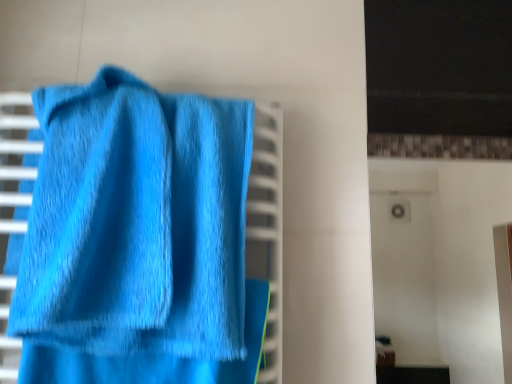
This screenshot has width=512, height=384. I want to click on blue fuzzy towel at left, so click(136, 222).

What do you see at coordinates (136, 222) in the screenshot?
I see `blue fuzzy towel at left` at bounding box center [136, 222].

At what (x,y) coordinates should I click in order to perform the action: click on blue fuzzy towel at left. Please return your answer as a coordinate pair (x, y). Looking at the image, I should click on (136, 222).